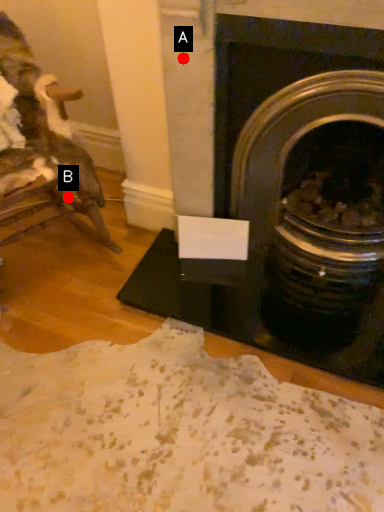
Question: Two points are circled on the image, labeled by A and B beside each circle. Which point appears closest to the camera in this image?

Choices:
 (A) A is closer
 (B) B is closer

Answer: (A)